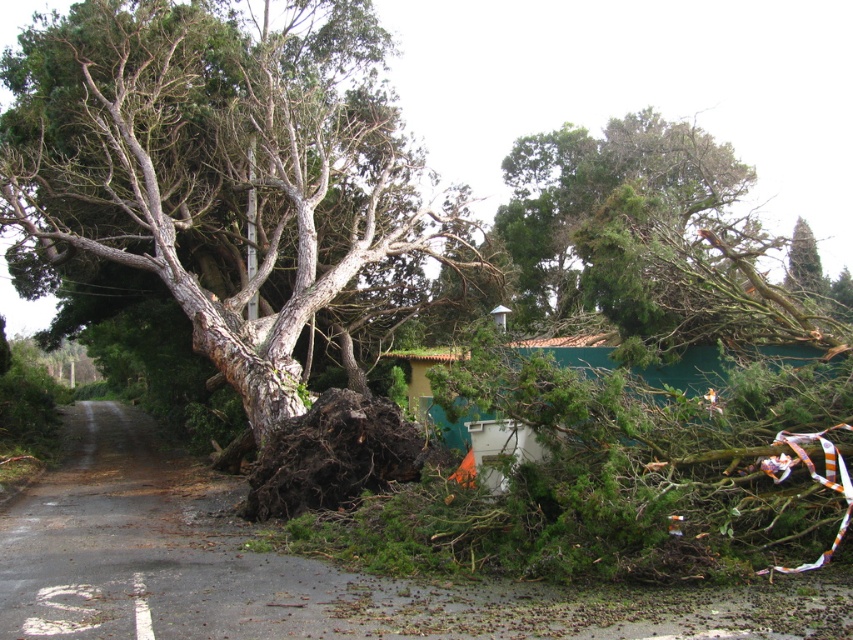
Question: Is brown rough bark tree at center to the right of green rough bark tree at upper right from the viewer's perspective?

Choices:
 (A) no
 (B) yes

Answer: (A)

Question: Is brown rough bark tree at center to the right of green rough bark tree at upper right from the viewer's perspective?

Choices:
 (A) no
 (B) yes

Answer: (A)

Question: Which object is farther from the camera taking this photo?

Choices:
 (A) green rough bark tree at upper right
 (B) brown rough bark tree at center

Answer: (A)

Question: Considering the relative positions of brown rough bark tree at center and green rough bark tree at upper right in the image provided, where is brown rough bark tree at center located with respect to green rough bark tree at upper right?

Choices:
 (A) above
 (B) below

Answer: (A)